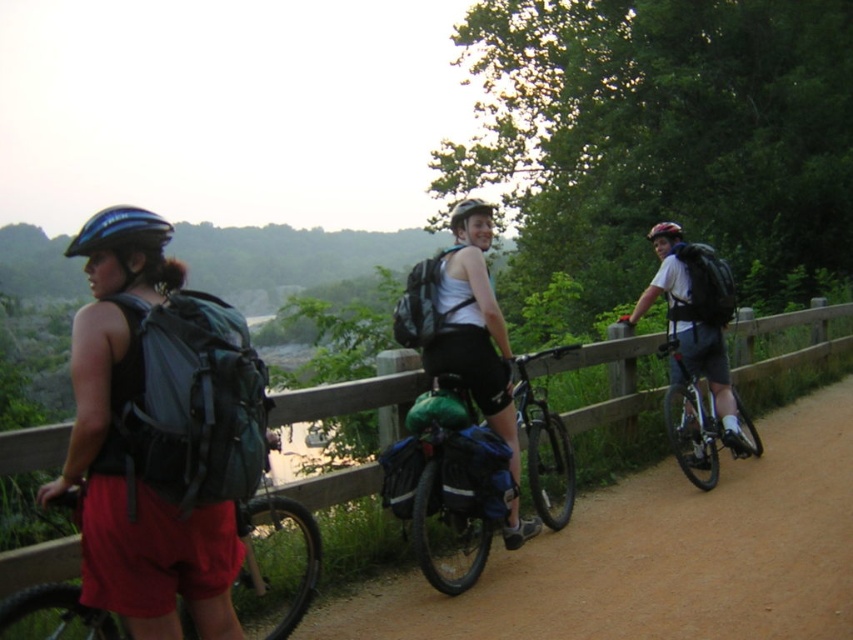
Question: Considering the real-world distances, which object is farthest from the wooden fence at center?

Choices:
 (A) shiny silver bicycle at right
 (B) matte black helmet at center
 (C) blue matte helmet at left
 (D) matte black helmet at upper right

Answer: (C)

Question: Does green fabric bag at center appear on the left side of blue matte helmet at left?

Choices:
 (A) yes
 (B) no

Answer: (B)

Question: Considering the relative positions of matte black bicycle at left and blue matte helmet at left in the image provided, where is matte black bicycle at left located with respect to blue matte helmet at left?

Choices:
 (A) left
 (B) right

Answer: (B)

Question: Does matte black backpack at right have a lesser width compared to matte black helmet at center?

Choices:
 (A) yes
 (B) no

Answer: (B)

Question: Among these objects, which one is farthest from the camera?

Choices:
 (A) wooden fence at center
 (B) green fabric bag at center
 (C) matte black shorts at center
 (D) blue matte helmet at left

Answer: (B)

Question: Among these objects, which one is farthest from the camera?

Choices:
 (A) green fabric bag at center
 (B) matte black bicycle at left
 (C) blue matte helmet at left

Answer: (A)